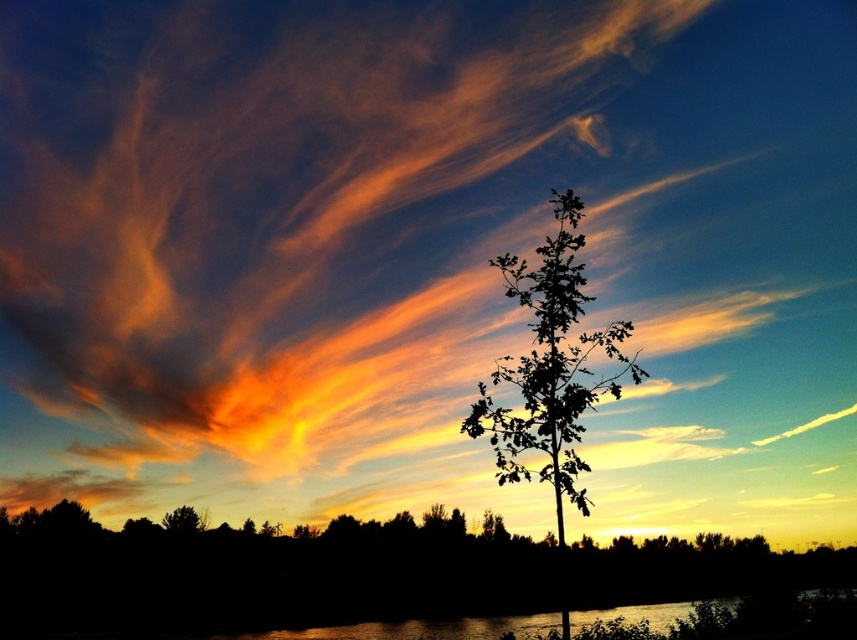
Is point (518, 268) closer to viewer compared to point (165, 518)?

Yes, it is.

Where is `silhouette leafy tree at center`? silhouette leafy tree at center is located at coordinates (550, 372).